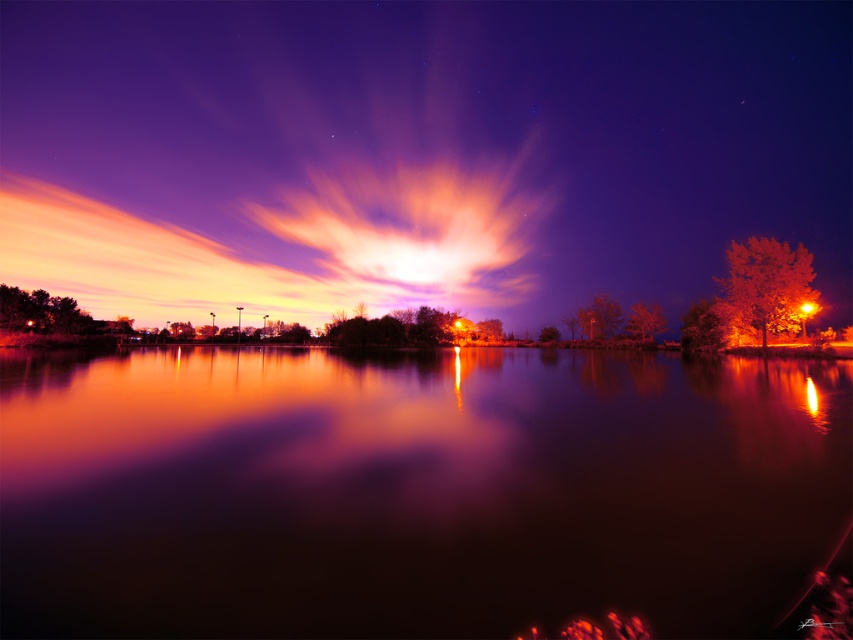
Is glossy reflective water at center smaller than radiant orange cloud at center?

Correct, glossy reflective water at center occupies less space than radiant orange cloud at center.

Measure the distance between glossy reflective water at center and camera.

A distance of 15.70 feet exists between glossy reflective water at center and camera.

Where is `glossy reflective water at center`? glossy reflective water at center is located at coordinates (413, 490).